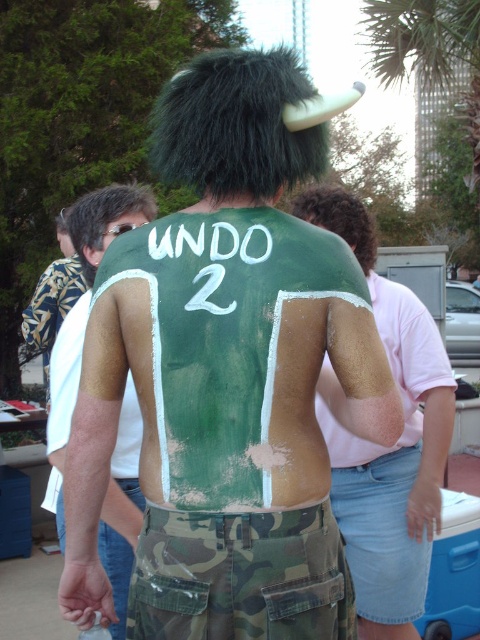
You are organizing a costume party and need to decide which shirt to wear. You have a white matte shirt at upper left and a matte gold shirt at upper right. Which shirt has a bigger size?

The white matte shirt at upper left is larger in size than the matte gold shirt at upper right, so the white matte shirt at upper left has a bigger size.

Looking at this image, you are a photographer trying to capture the green matte body paint at center. Where should you position your camera to ensure the point at coordinates (227, 376) is in the frame?

The point at coordinates (227, 376) corresponds to the green matte body paint at center, so positioning the camera to aim directly at the center of the green matte body paint at center will ensure the point is in the frame.